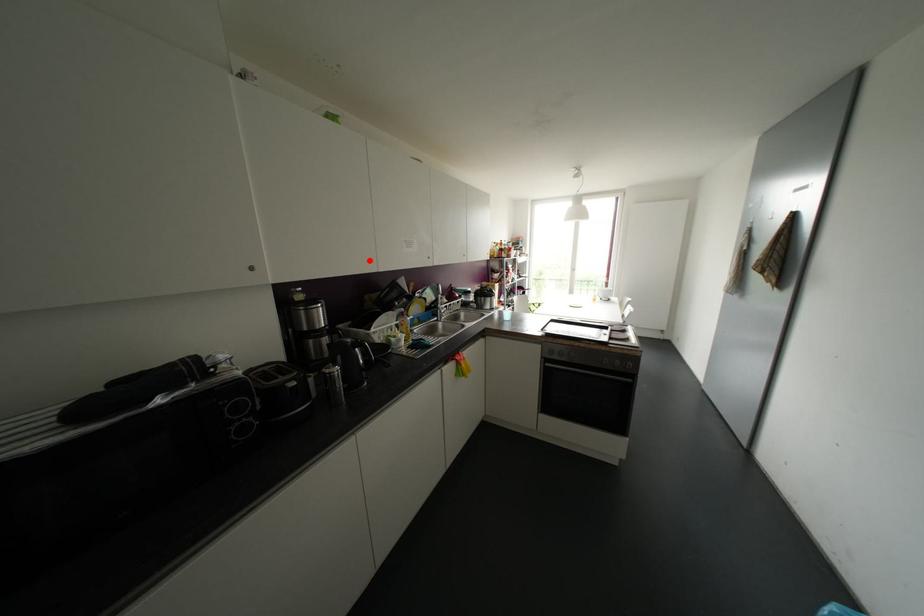
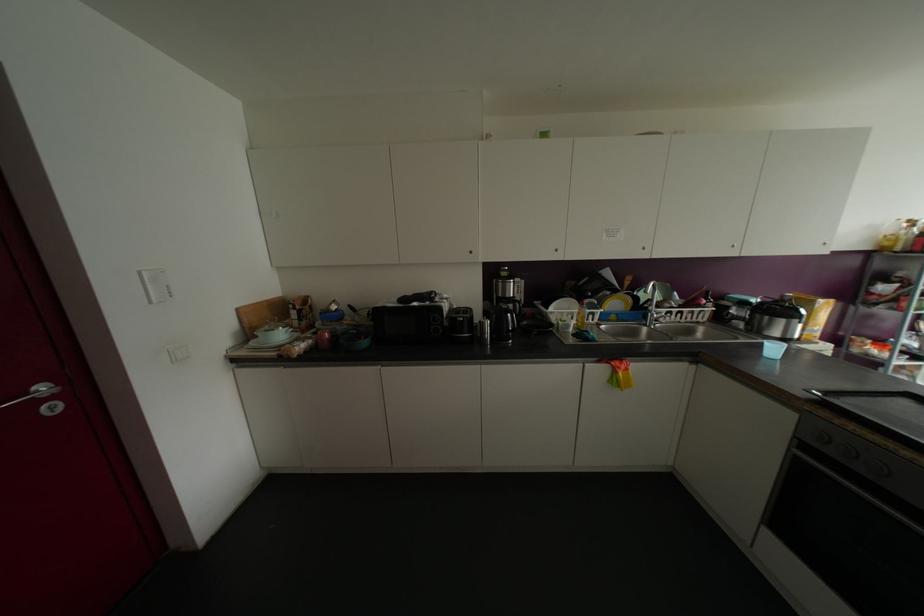
The point at the highlighted location is marked in the first image. Where is the corresponding point in the second image?

(555, 249)